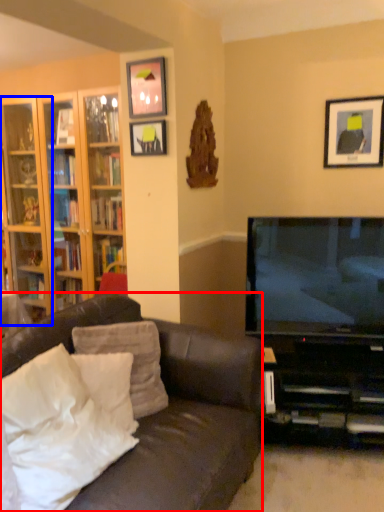
Question: Which object appears closest to the camera in this image, studio couch (highlighted by a red box) or shelf (highlighted by a blue box)?

Choices:
 (A) studio couch
 (B) shelf

Answer: (A)